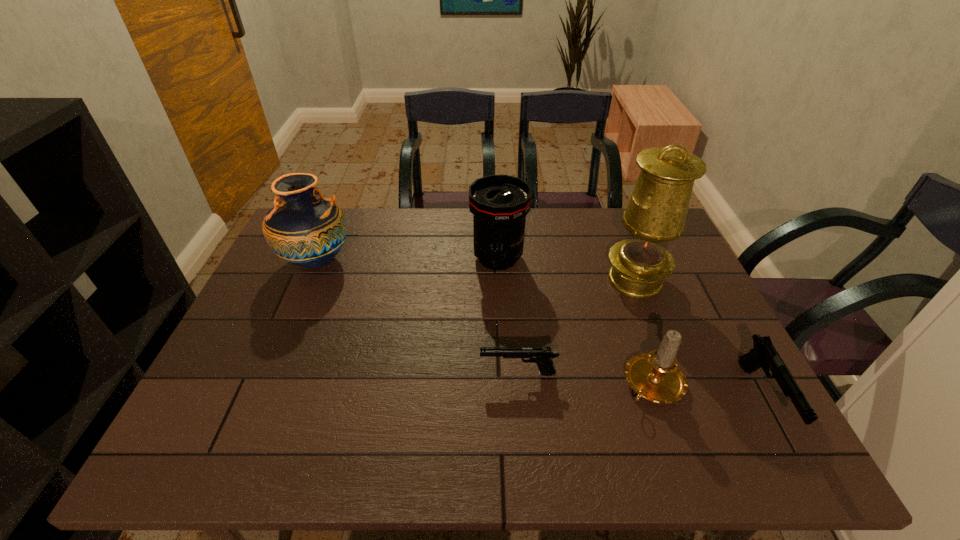
In the current image, all guns are evenly spaced. To maintain this equal spacing, where should an additional gun be placed on the left? Please point out a free spot. Please provide its 2D coordinates. Your answer should be formatted as a tuple, i.e. [(x, y)], where the tuple contains the x and y coordinates of a point satisfying the conditions above.

[(297, 350)]